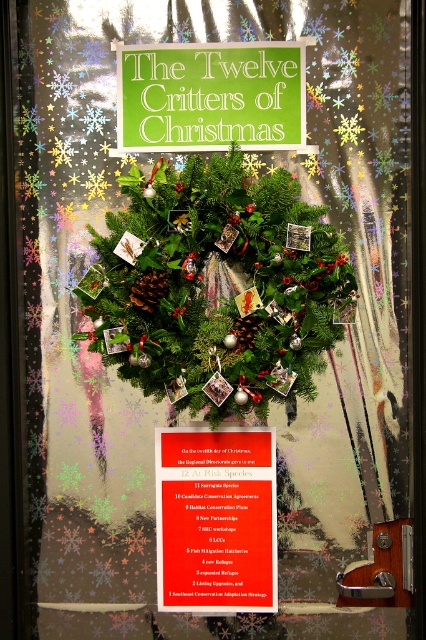
Which is more to the right, green matte wreath at center or green paper sign at upper center?

From the viewer's perspective, green paper sign at upper center appears more on the right side.

Is the position of green matte wreath at center less distant than that of green paper sign at upper center?

Yes, green matte wreath at center is closer to the viewer.

Between point (167, 310) and point (149, 122), which one is positioned in front?

Point (167, 310) is in front.

Find the location of `green matte wreath at center`. green matte wreath at center is located at coordinates (204, 276).

Who is positioned more to the left, matte red poster at center or brown textured pine cone at center?

brown textured pine cone at center is more to the left.

Does matte red poster at center have a lesser width compared to brown textured pine cone at center?

No, matte red poster at center is not thinner than brown textured pine cone at center.

Between point (198, 480) and point (158, 289), which one is positioned behind?

Point (198, 480)

At what (x,y) coordinates should I click in order to perform the action: click on matte red poster at center. Please return your answer as a coordinate pair (x, y). Looking at the image, I should click on (215, 518).

This screenshot has width=426, height=640. What do you see at coordinates (204, 276) in the screenshot? I see `green matte wreath at center` at bounding box center [204, 276].

Is green matte wreath at center bigger than matte red poster at center?

Yes.

Is point (201, 170) positioned after point (218, 512)?

No, it is in front of (218, 512).

Locate an element on the screen. This screenshot has width=426, height=640. green matte wreath at center is located at coordinates (204, 276).